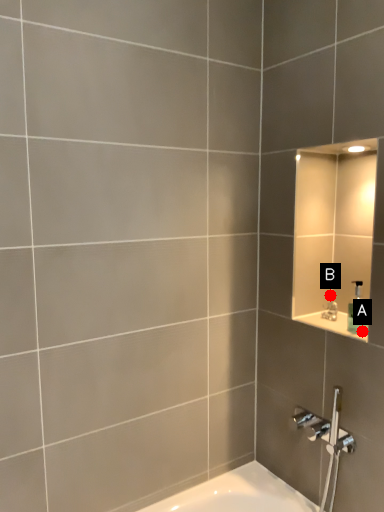
Question: Two points are circled on the image, labeled by A and B beside each circle. Which point is closer to the camera taking this photo?

Choices:
 (A) A is closer
 (B) B is closer

Answer: (A)